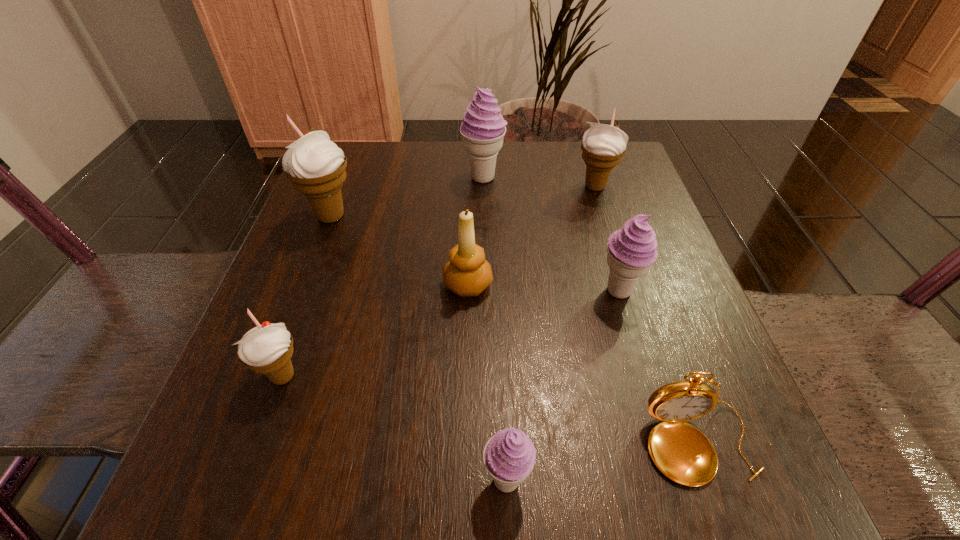
Identify the location of icecream located in the near edge section of the desktop. The width and height of the screenshot is (960, 540). (509, 456).

At what (x,y) coordinates should I click in order to perform the action: click on pocket watch at the near edge. Please return your answer as a coordinate pair (x, y). This screenshot has width=960, height=540. Looking at the image, I should click on (680, 451).

Image resolution: width=960 pixels, height=540 pixels. In order to click on pocket watch that is at the right edge in this screenshot , I will do `click(680, 451)`.

You are a GUI agent. You are given a task and a screenshot of the screen. Output one action in this format:
    pyautogui.click(x=<x>, y=<y>)
    Task: Click on the object located at the far right corner
    Image resolution: width=960 pixels, height=540 pixels.
    Given the screenshot: What is the action you would take?
    pyautogui.click(x=603, y=145)

The width and height of the screenshot is (960, 540). What are the coordinates of `object at the near right corner` in the screenshot? It's located at (680, 451).

Locate an element on the screen. Image resolution: width=960 pixels, height=540 pixels. vacant space at the far edge is located at coordinates (557, 159).

At what (x,y) coordinates should I click in order to perform the action: click on vacant space at the near edge of the desktop. Please return your answer as a coordinate pair (x, y). The image size is (960, 540). Looking at the image, I should click on (342, 452).

This screenshot has height=540, width=960. What are the coordinates of `vacant space at the left edge of the desktop` in the screenshot? It's located at (343, 281).

Find the location of `free space at the right edge`. free space at the right edge is located at coordinates (667, 285).

You are a GUI agent. You are given a task and a screenshot of the screen. Output one action in this format:
    pyautogui.click(x=<x>, y=<y>)
    Task: Click on the free space at the near left corner of the desktop
    
    Given the screenshot: What is the action you would take?
    pyautogui.click(x=249, y=470)